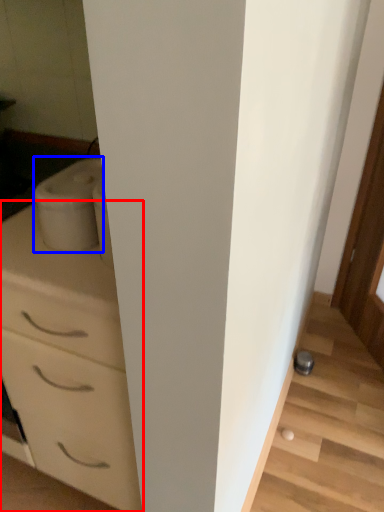
Question: Among these objects, which one is farthest to the camera, chest of drawers (highlighted by a red box) or appliance (highlighted by a blue box)?

Choices:
 (A) chest of drawers
 (B) appliance

Answer: (B)